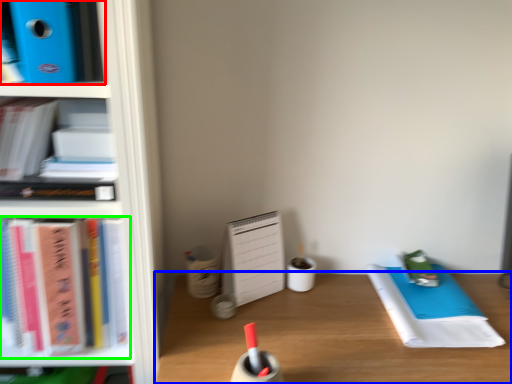
Question: Which object is positioned farthest from book (highlighted by a red box)? Select from desk (highlighted by a blue box) and book (highlighted by a green box).

Choices:
 (A) desk
 (B) book

Answer: (A)